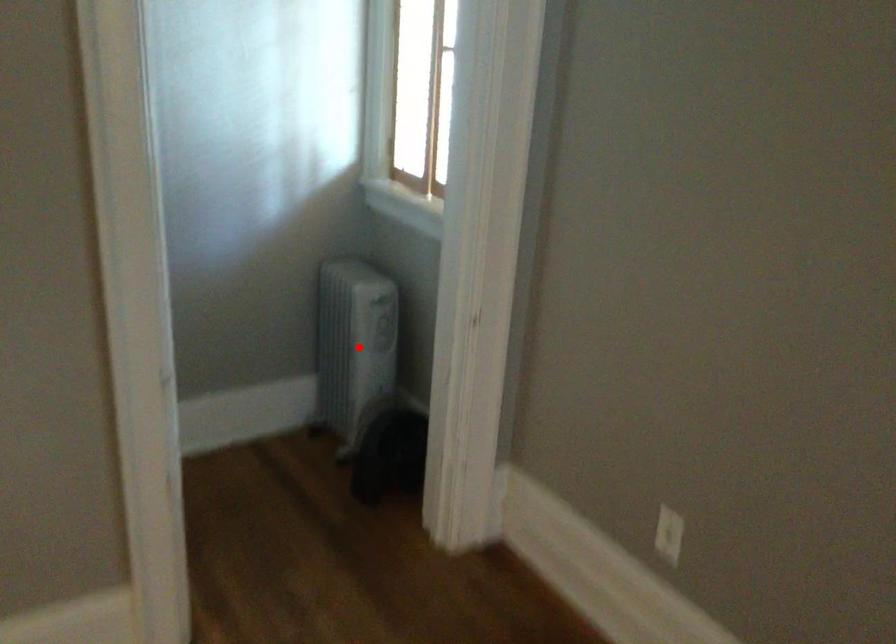
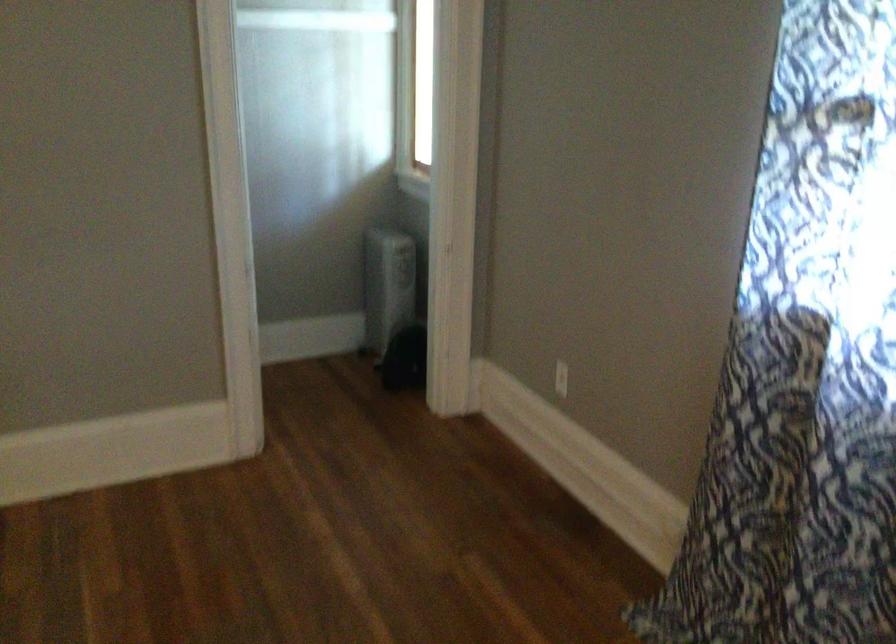
Where in the second image is the point corresponding to the highlighted location from the first image?

(388, 285)